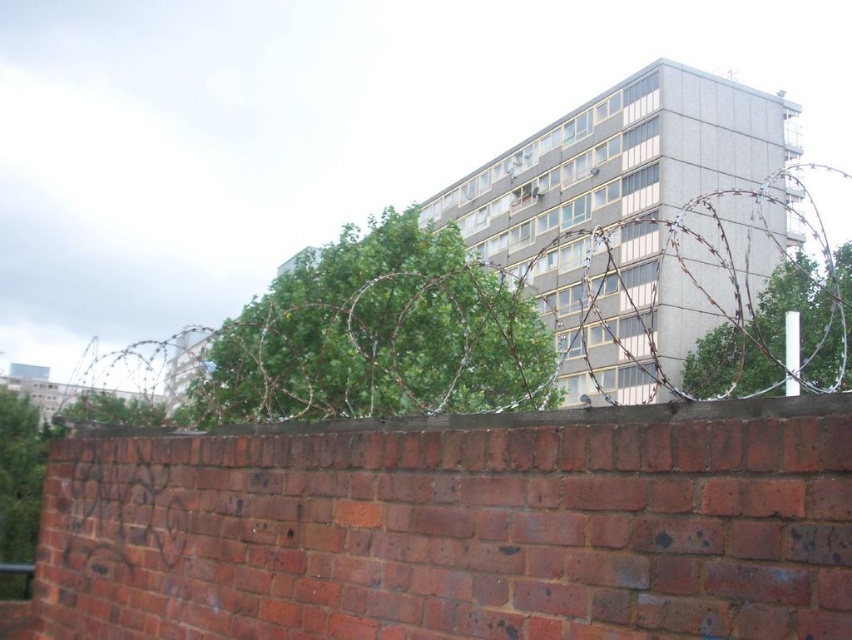
You are a painter who needs to assess the height of the red brick wall at lower center and the barbed wire at upper center. Which object is shorter in height?

The red brick wall at lower center has a lesser height compared to the barbed wire at upper center, so the red brick wall at lower center is shorter in height.

You are standing in front of a brick wall with barbed wire on top. There is a point marked at coordinates (458, 528). What does this point indicate?

The point at coordinates (458, 528) marks the red brick wall at lower center.

You are standing in front of a brick wall with a barbed wire fence and a modern building behind it. You see two points marked on the wall. The first point is at coordinates point (557,410) and the second is at point (783,173). If you were to walk towards the wall, which point would you encounter first?

Point (557,410) is in front of point (783,173), so you would encounter point (557,410) first when walking towards the wall.